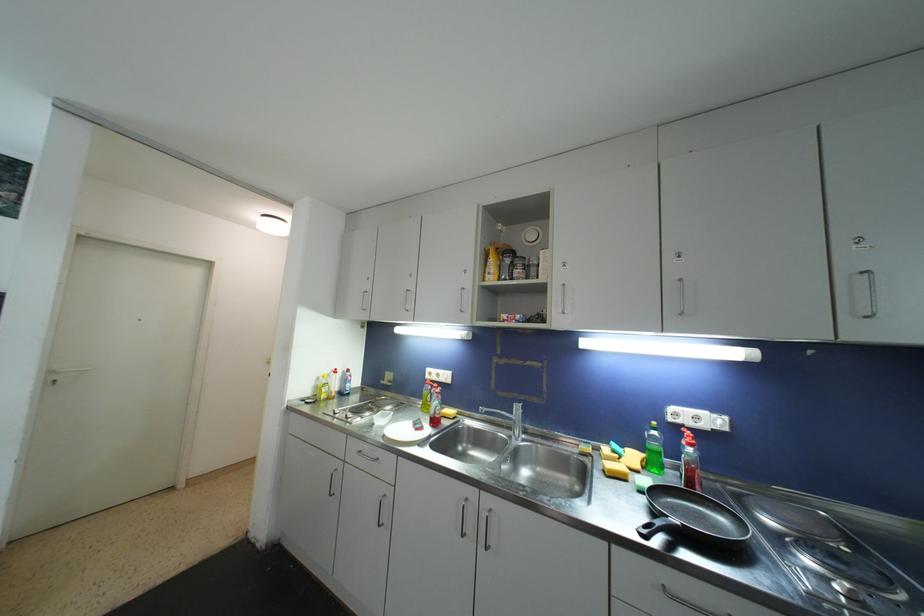
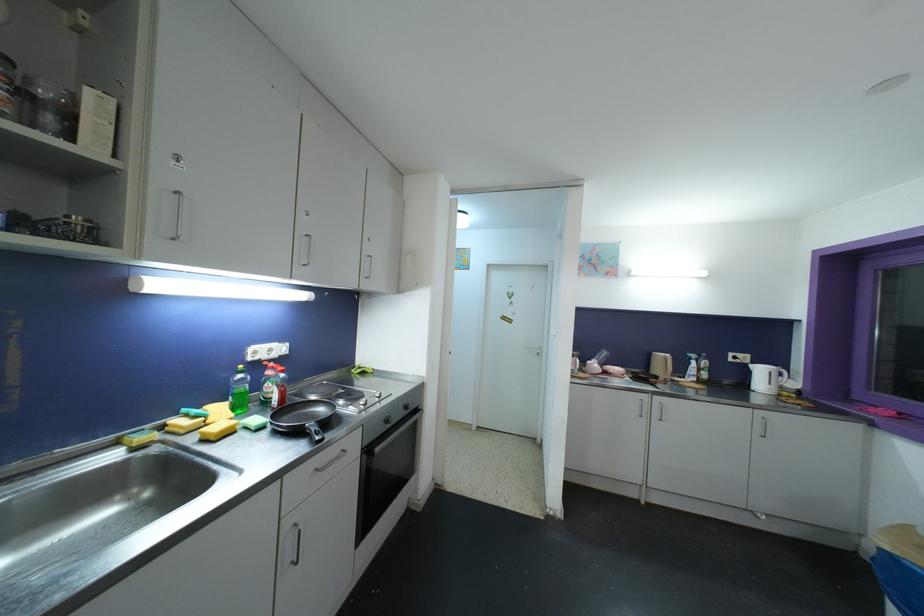
In the second image, find the point that corresponds to (x=628, y=477) in the first image.

(236, 430)